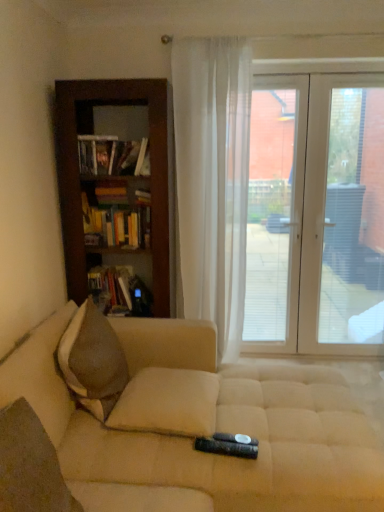
Identify the location of free point above hardcover book at left, marked as the third book in a bottom-to-top arrangement (from a real-world perspective). (99, 135).